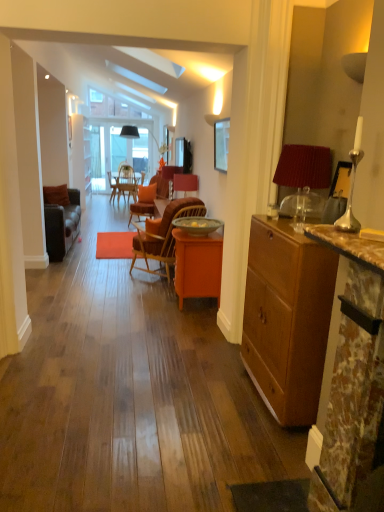
Identify the location of orange wood desk at center. The image size is (384, 512). (197, 265).

Measure the distance between brown marble fireplace at right and camera.

The depth of brown marble fireplace at right is 1.22 meters.

What are the coordinates of `red fabric lampshade at right` in the screenshot? It's located at (303, 179).

From the picture: Measure the distance between woven wood chair at center, arranged as the second chair when viewed from the back, and camera.

The distance of woven wood chair at center, arranged as the second chair when viewed from the back, from camera is 4.25 meters.

Where is `orange wood desk at center`? This screenshot has height=512, width=384. orange wood desk at center is located at coordinates (197, 265).

Is matte glass picture frame at upper center located outside wooden cabinet at right?

matte glass picture frame at upper center is positioned outside wooden cabinet at right.

Considering the sizes of matte glass picture frame at upper center and wooden cabinet at right in the image, is matte glass picture frame at upper center bigger or smaller than wooden cabinet at right?

matte glass picture frame at upper center is smaller than wooden cabinet at right.

Is matte glass picture frame at upper center further to camera compared to wooden cabinet at right?

Yes.

Is brown marble fireplace at right spatially inside orange wood desk at center, or outside of it?

brown marble fireplace at right is spatially situated outside orange wood desk at center.

From the image's perspective, is brown marble fireplace at right above orange wood desk at center?

Yes, from the image's perspective, brown marble fireplace at right is above orange wood desk at center.

From a real-world perspective, is brown marble fireplace at right on top of orange wood desk at center?

Correct, in the physical world, brown marble fireplace at right is higher than orange wood desk at center.

From a real-world perspective, is woven wood chair at center, the first chair positioned from the front, located higher than red fabric lampshade at right?

No, from a real-world perspective, woven wood chair at center, the first chair positioned from the front, is not over red fabric lampshade at right

Is woven wood chair at center, which is counted as the first chair, starting from the bottom, oriented away from red fabric lampshade at right?

No.

What's the angular difference between woven wood chair at center, arranged as the second chair when viewed from the back, and red fabric lampshade at right's facing directions?

0.0241 degrees.

In terms of width, does woven wood chair at center, the first chair positioned from the front, look wider or thinner when compared to red fabric lampshade at right?

Considering their sizes, woven wood chair at center, the first chair positioned from the front, looks broader than red fabric lampshade at right.

Considering the sizes of matte glass picture frame at upper center and red fabric lampshade at right in the image, is matte glass picture frame at upper center taller or shorter than red fabric lampshade at right?

In the image, matte glass picture frame at upper center appears to be taller than red fabric lampshade at right.

Can you confirm if matte glass picture frame at upper center is positioned to the right of red fabric lampshade at right?

No, matte glass picture frame at upper center is not to the right of red fabric lampshade at right.

Can you see matte glass picture frame at upper center touching red fabric lampshade at right?

No.

How distant is matte glass picture frame at upper center from red fabric lampshade at right?

3.94 feet.

Can you confirm if velvet orange chair at center, the second chair in the front-to-back sequence, is taller than matte glass picture frame at upper center?

No, velvet orange chair at center, the second chair in the front-to-back sequence, is not taller than matte glass picture frame at upper center.

Based on the photo, considering the sizes of objects velvet orange chair at center, which is counted as the first chair, starting from the back, and matte glass picture frame at upper center in the image provided, who is wider, velvet orange chair at center, which is counted as the first chair, starting from the back, or matte glass picture frame at upper center?

velvet orange chair at center, which is counted as the first chair, starting from the back.

Is velvet orange chair at center, the second chair in the front-to-back sequence, facing away from matte glass picture frame at upper center?

velvet orange chair at center, the second chair in the front-to-back sequence, is not turned away from matte glass picture frame at upper center.

How different are the orientations of velvet orange chair at center, marked as the 1th chair in a top-to-bottom arrangement, and matte glass picture frame at upper center in degrees?

There is a 0.964-degree angle between the facing directions of velvet orange chair at center, marked as the 1th chair in a top-to-bottom arrangement, and matte glass picture frame at upper center.

Could you tell me if velvet orange chair at center, which is counted as the first chair, starting from the back, is facing woven wood chair at center, which appears as the second chair when viewed from the top?

No, velvet orange chair at center, which is counted as the first chair, starting from the back, is not aimed at woven wood chair at center, which appears as the second chair when viewed from the top.

Is velvet orange chair at center, which is counted as the first chair, starting from the back, not inside woven wood chair at center, the first chair positioned from the front?

Yes.

From the image's perspective, which object appears higher, velvet orange chair at center, which is counted as the first chair, starting from the back, or woven wood chair at center, the first chair positioned from the front?

velvet orange chair at center, which is counted as the first chair, starting from the back, appears higher in the image.

Is orange wood desk at center in front of or behind woven wood chair at center, which is counted as the first chair, starting from the bottom, in the image?

Visually, orange wood desk at center is located in front of woven wood chair at center, which is counted as the first chair, starting from the bottom.

Can you confirm if orange wood desk at center is smaller than woven wood chair at center, the first chair positioned from the front?

Correct, orange wood desk at center occupies less space than woven wood chair at center, the first chair positioned from the front.

Is woven wood chair at center, which appears as the second chair when viewed from the top, at the back of orange wood desk at center?

No, orange wood desk at center's orientation is not away from woven wood chair at center, which appears as the second chair when viewed from the top.

Between orange wood desk at center and woven wood chair at center, which is counted as the first chair, starting from the bottom, which one has more height?

woven wood chair at center, which is counted as the first chair, starting from the bottom.

The width and height of the screenshot is (384, 512). Find the location of `picture frame that is behind the wooden cabinet at right`. picture frame that is behind the wooden cabinet at right is located at coordinates (221, 144).

Where is `counter top above the orange wood desk at center (from the image's perspective)`? This screenshot has height=512, width=384. counter top above the orange wood desk at center (from the image's perspective) is located at coordinates (349, 246).

Considering their positions, is brown marble fireplace at right positioned further to orange wood desk at center than red fabric lampshade at right?

brown marble fireplace at right lies further to orange wood desk at center than the other object.

Looking at the image, which one is located closer to matte glass picture frame at upper center, brown marble fireplace at right or wooden cabinet at right?

wooden cabinet at right is closer to matte glass picture frame at upper center.

Which object lies nearer to the anchor point wooden cabinet at right, brown marble fireplace at right or woven wood chair at center, arranged as the second chair when viewed from the back?

brown marble fireplace at right is closer to wooden cabinet at right.

Based on their spatial positions, is matte glass picture frame at upper center or brown marble fireplace at right further from orange wood desk at center?

Among the two, brown marble fireplace at right is located further to orange wood desk at center.

Estimate the real-world distances between objects in this image. Which object is closer to red fabric lampshade at right, woven wood chair at center, which is counted as the first chair, starting from the bottom, or brown marble fireplace at right?

brown marble fireplace at right is closer to red fabric lampshade at right.

From the image, which object appears to be farther from red fabric lampshade at right, wooden cabinet at right or brown marble fireplace at right?

Among the two, brown marble fireplace at right is located further to red fabric lampshade at right.

Considering their positions, is orange wood desk at center positioned further to woven wood chair at center, which is counted as the first chair, starting from the bottom, than brown marble fireplace at right?

brown marble fireplace at right lies further to woven wood chair at center, which is counted as the first chair, starting from the bottom, than the other object.

In the scene shown: Based on their spatial positions, is red fabric lampshade at right or orange wood desk at center further from woven wood chair at center, which appears as the second chair when viewed from the top?

red fabric lampshade at right is further to woven wood chair at center, which appears as the second chair when viewed from the top.

Identify the location of picture frame between red fabric lampshade at right and velvet orange chair at center, marked as the 1th chair in a top-to-bottom arrangement, along the z-axis. (221, 144).

Where is `picture frame between wooden cabinet at right and velvet orange chair at center, marked as the 1th chair in a top-to-bottom arrangement, in the front-back direction`? This screenshot has width=384, height=512. picture frame between wooden cabinet at right and velvet orange chair at center, marked as the 1th chair in a top-to-bottom arrangement, in the front-back direction is located at coordinates (221, 144).

You are a GUI agent. You are given a task and a screenshot of the screen. Output one action in this format:
    pyautogui.click(x=<x>, y=<y>)
    Task: Click on the picture frame positioned between red fabric lampshade at right and woven wood chair at center, which is counted as the first chair, starting from the bottom, from near to far
    This screenshot has width=384, height=512.
    Given the screenshot: What is the action you would take?
    pyautogui.click(x=221, y=144)

The height and width of the screenshot is (512, 384). I want to click on lamp between wooden cabinet at right and matte glass picture frame at upper center in the front-back direction, so click(303, 179).